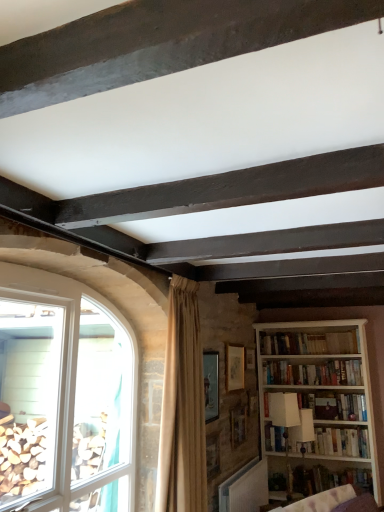
What is the approximate height of wooden bookshelf at lower right, the first book positioned from the bottom?

wooden bookshelf at lower right, the first book positioned from the bottom, is 10.54 inches tall.

Where is `wooden bookshelf at lower right, which is the fourth book from top to bottom`? This screenshot has height=512, width=384. wooden bookshelf at lower right, which is the fourth book from top to bottom is located at coordinates (329, 479).

What is the approximate width of matte gold picture frame at center, which appears as the 4th picture frame when viewed from the front?

1.49 inches.

This screenshot has width=384, height=512. What do you see at coordinates (182, 407) in the screenshot? I see `beige fabric curtain at center` at bounding box center [182, 407].

Locate an element on the screen. white wooden bookcase at right is located at coordinates (321, 399).

From a real-world perspective, is white wooden bookshelf at center, which is the 2th book in top-to-bottom order, located higher than wooden picture frame at center, the 4th picture frame positioned from the back?

Yes.

Is white wooden bookshelf at center, which is counted as the third book, starting from the bottom, looking in the opposite direction of wooden picture frame at center, which ranks as the 1th picture frame in front-to-back order?

That's not correct — white wooden bookshelf at center, which is counted as the third book, starting from the bottom, is not looking away from wooden picture frame at center, which ranks as the 1th picture frame in front-to-back order.

How much distance is there between white wooden bookshelf at center, which is counted as the third book, starting from the bottom, and wooden picture frame at center, the 4th picture frame positioned from the back?

The distance of white wooden bookshelf at center, which is counted as the third book, starting from the bottom, from wooden picture frame at center, the 4th picture frame positioned from the back, is 5.20 feet.

How many degrees apart are the facing directions of white wooden bookshelf at center, which is the 2th book in top-to-bottom order, and wooden picture frame at center, which ranks as the 1th picture frame in front-to-back order?

91.3 degrees separate the facing orientations of white wooden bookshelf at center, which is the 2th book in top-to-bottom order, and wooden picture frame at center, which ranks as the 1th picture frame in front-to-back order.

Can you confirm if white wooden bookshelf at center, which is counted as the third book, starting from the bottom, is positioned to the left of clear glass window at lower left?

No, white wooden bookshelf at center, which is counted as the third book, starting from the bottom, is not to the left of clear glass window at lower left.

Would you say white wooden bookshelf at center, which is counted as the third book, starting from the bottom, is outside clear glass window at lower left?

white wooden bookshelf at center, which is counted as the third book, starting from the bottom, lies outside clear glass window at lower left's area.

Which object is further away from the camera taking this photo, white wooden bookshelf at center, which is the 2th book in top-to-bottom order, or clear glass window at lower left?

white wooden bookshelf at center, which is the 2th book in top-to-bottom order, is more distant.

What's the angular difference between wooden picture frame at center, the third picture frame in the front-to-back sequence, and white wooden bookcase at right's facing directions?

90.1 degrees separate the facing orientations of wooden picture frame at center, the third picture frame in the front-to-back sequence, and white wooden bookcase at right.

From the picture: Is wooden picture frame at center, the third picture frame in the front-to-back sequence, turned away from white wooden bookcase at right?

No, wooden picture frame at center, the third picture frame in the front-to-back sequence, is not facing away from white wooden bookcase at right.

Between wooden picture frame at center, the third picture frame in the front-to-back sequence, and white wooden bookcase at right, which one has smaller size?

wooden picture frame at center, the third picture frame in the front-to-back sequence.

Consider the image. Could white wooden bookcase at right be considered to be inside wooden picture frame at center, the third picture frame in the front-to-back sequence?

No, white wooden bookcase at right is not surrounded by wooden picture frame at center, the third picture frame in the front-to-back sequence.

Is wooden picture frame at center, arranged as the 2th picture frame when viewed from the back, oriented towards white paperback book at right, the 2th book ordered from the bottom?

No, wooden picture frame at center, arranged as the 2th picture frame when viewed from the back, does not turn towards white paperback book at right, the 2th book ordered from the bottom.

Is point (242, 407) less distant than point (321, 449)?

Yes, it is in front of point (321, 449).

Is wooden picture frame at center, arranged as the 2th picture frame when viewed from the back, closer to camera compared to white paperback book at right, marked as the 3th book in a top-to-bottom arrangement?

Yes, it is.

Based on their positions, is wooden picture frame at center, arranged as the 2th picture frame when viewed from the back, located to the left or right of white paperback book at right, the 2th book ordered from the bottom?

From the image, it's evident that wooden picture frame at center, arranged as the 2th picture frame when viewed from the back, is to the left of white paperback book at right, the 2th book ordered from the bottom.

In the scene shown: Is clear glass window at lower left looking in the opposite direction of beige fabric curtain at center?

clear glass window at lower left does not have its back to beige fabric curtain at center.

Considering the relative sizes of clear glass window at lower left and beige fabric curtain at center in the image provided, is clear glass window at lower left taller than beige fabric curtain at center?

Indeed, clear glass window at lower left has a greater height compared to beige fabric curtain at center.

Is clear glass window at lower left with beige fabric curtain at center?

No, clear glass window at lower left is not touching beige fabric curtain at center.

Find the location of a particular element. Image resolution: width=384 pixels, height=512 pixels. window in front of the beige fabric curtain at center is located at coordinates (64, 396).

Based on the photo, considering the relative sizes of white paperback book at right, marked as the 3th book in a top-to-bottom arrangement, and beige fabric curtain at center in the image provided, is white paperback book at right, marked as the 3th book in a top-to-bottom arrangement, wider than beige fabric curtain at center?

No.

Is point (271, 430) less distant than point (191, 498)?

No.

Can you tell me how much white paperback book at right, marked as the 3th book in a top-to-bottom arrangement, and beige fabric curtain at center differ in facing direction?

They differ by 86.4 degrees in their facing directions.

Which of these two, white paperback book at right, the 2th book ordered from the bottom, or beige fabric curtain at center, stands shorter?

With less height is white paperback book at right, the 2th book ordered from the bottom.

Measure the distance from wooden bookshelf at lower right, the first book positioned from the bottom, to wooden picture frame at center, the third picture frame in the front-to-back sequence.

They are 34.79 inches apart.

Considering the positions of objects wooden bookshelf at lower right, the first book positioned from the bottom, and wooden picture frame at center, the third picture frame in the front-to-back sequence, in the image provided, who is more to the left, wooden bookshelf at lower right, the first book positioned from the bottom, or wooden picture frame at center, the third picture frame in the front-to-back sequence,?

wooden picture frame at center, the third picture frame in the front-to-back sequence.

In the scene shown: Which object is closer to the camera taking this photo, wooden bookshelf at lower right, which is the fourth book from top to bottom, or wooden picture frame at center, the third picture frame in the front-to-back sequence?

Positioned in front is wooden picture frame at center, the third picture frame in the front-to-back sequence.

Considering the sizes of objects wooden bookshelf at lower right, the first book positioned from the bottom, and wooden picture frame at center, arranged as the 2th picture frame when viewed from the back, in the image provided, who is bigger, wooden bookshelf at lower right, the first book positioned from the bottom, or wooden picture frame at center, arranged as the 2th picture frame when viewed from the back,?

Bigger between the two is wooden bookshelf at lower right, the first book positioned from the bottom.

This screenshot has height=512, width=384. Find the location of `picture frame that is the 4th object located in front of the white wooden bookshelf at center, which is the 2th book in top-to-bottom order`. picture frame that is the 4th object located in front of the white wooden bookshelf at center, which is the 2th book in top-to-bottom order is located at coordinates (213, 454).

Identify the location of window on the left of the white wooden bookshelf at center, which is the 2th book in top-to-bottom order. Image resolution: width=384 pixels, height=512 pixels. pyautogui.click(x=64, y=396).

Based on their spatial positions, is white wooden bookcase at right or wooden picture frame at center, which ranks as the 1th picture frame in front-to-back order, closer to beige fabric curtain at center?

Among the two, wooden picture frame at center, which ranks as the 1th picture frame in front-to-back order, is located nearer to beige fabric curtain at center.

When comparing their distances from wooden picture frame at center, the 4th picture frame positioned from the back, does beige fabric curtain at center or white paperback book at right, marked as the 3th book in a top-to-bottom arrangement, seem closer?

beige fabric curtain at center.

Which object lies further to the anchor point clear glass window at lower left, white matte bookshelf at right, which is the 4th book from bottom to top, or white paperback book at right, marked as the 3th book in a top-to-bottom arrangement?

white paperback book at right, marked as the 3th book in a top-to-bottom arrangement, lies further to clear glass window at lower left than the other object.

Looking at the image, which one is located closer to wooden picture frame at center, the second picture frame from the front, matte gold picture frame at center, which appears as the 4th picture frame when viewed from the front, or clear glass window at lower left?

matte gold picture frame at center, which appears as the 4th picture frame when viewed from the front, is closer to wooden picture frame at center, the second picture frame from the front.

Based on the photo, based on their spatial positions, is clear glass window at lower left or matte gold picture frame at center, which is the 1th picture frame from back to front, further from wooden picture frame at center, acting as the third picture frame starting from the back?

clear glass window at lower left is further to wooden picture frame at center, acting as the third picture frame starting from the back.

Considering their positions, is matte gold picture frame at center, which appears as the 4th picture frame when viewed from the front, positioned further to white wooden bookshelf at center, which is counted as the third book, starting from the bottom, than beige fabric curtain at center?

beige fabric curtain at center lies further to white wooden bookshelf at center, which is counted as the third book, starting from the bottom, than the other object.

Estimate the real-world distances between objects in this image. Which object is closer to white paperback book at right, the 2th book ordered from the bottom, clear glass window at lower left or wooden bookshelf at lower right, the first book positioned from the bottom?

wooden bookshelf at lower right, the first book positioned from the bottom, lies closer to white paperback book at right, the 2th book ordered from the bottom, than the other object.

From the picture: When comparing their distances from white wooden bookshelf at center, which is counted as the third book, starting from the bottom, does white paperback book at right, marked as the 3th book in a top-to-bottom arrangement, or matte gold picture frame at center, which appears as the 4th picture frame when viewed from the front, seem closer?

The object closer to white wooden bookshelf at center, which is counted as the third book, starting from the bottom, is white paperback book at right, marked as the 3th book in a top-to-bottom arrangement.

This screenshot has height=512, width=384. I want to click on curtain between clear glass window at lower left and white wooden bookshelf at center, which is counted as the third book, starting from the bottom, from front to back, so click(x=182, y=407).

I want to click on bookcase between beige fabric curtain at center and wooden bookshelf at lower right, which is the fourth book from top to bottom, from front to back, so click(x=321, y=399).

Where is `curtain between clear glass window at lower left and white wooden bookcase at right in the front-back direction`? Image resolution: width=384 pixels, height=512 pixels. curtain between clear glass window at lower left and white wooden bookcase at right in the front-back direction is located at coordinates (182, 407).

The height and width of the screenshot is (512, 384). I want to click on book between white matte bookshelf at right, the 1th book when ordered from top to bottom, and white paperback book at right, marked as the 3th book in a top-to-bottom arrangement, in the up-down direction, so click(313, 373).